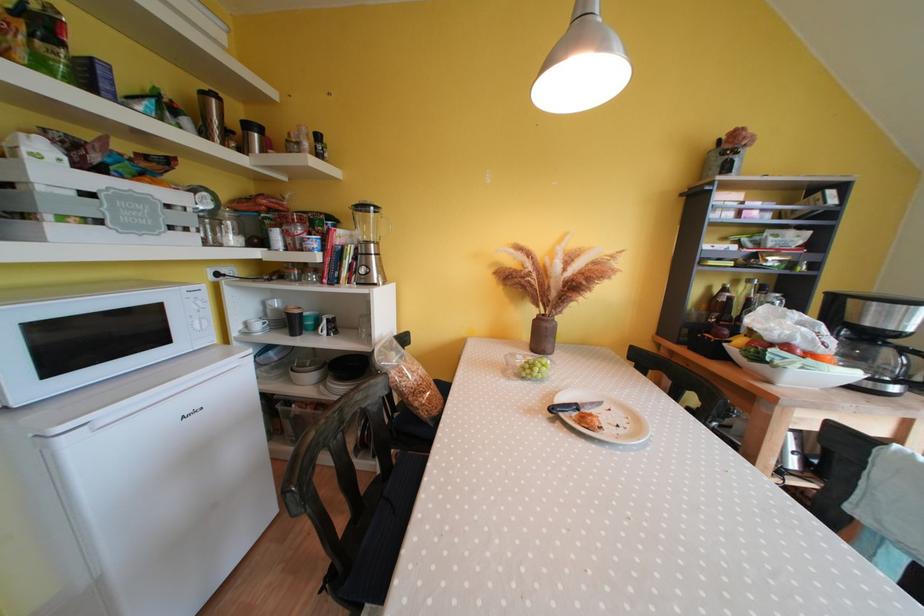
This screenshot has width=924, height=616. What are the coordinates of `black coffee mug` in the screenshot? It's located at (294, 320).